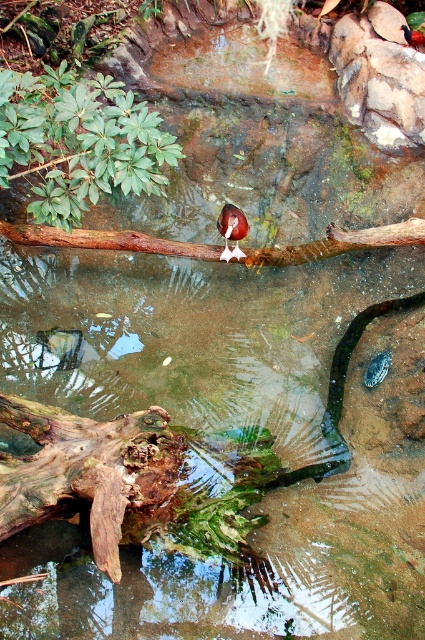
Is brown wood at center bigger than brown feathered bird at center?

Indeed, brown wood at center has a larger size compared to brown feathered bird at center.

Find the location of a particular element. The height and width of the screenshot is (640, 425). brown wood at center is located at coordinates (107, 241).

Can you confirm if brown feathered bird at center is shorter than brown glossy bird at center?

No, brown feathered bird at center is not shorter than brown glossy bird at center.

Is brown feathered bird at center positioned behind brown glossy bird at center?

No, it is not.

Find the location of `brown feathered bird at center`. brown feathered bird at center is located at coordinates (232, 230).

Does point (0, 122) come behind point (101, 243)?

That is False.

Is point (112, 160) behind point (8, 227)?

That is False.

What are the coordinates of `green leafy plant at upper left` in the screenshot? It's located at (79, 141).